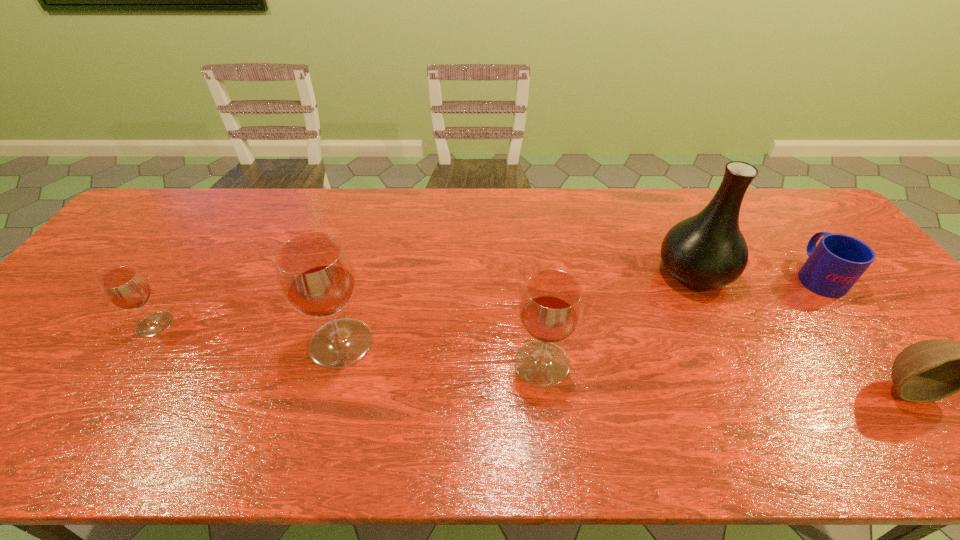
Locate an element on the screen. This screenshot has width=960, height=540. the shortest wineglass is located at coordinates (125, 287).

The image size is (960, 540). I want to click on the leftmost object, so click(x=125, y=287).

The image size is (960, 540). I want to click on the second object from left to right, so click(315, 274).

At what (x,y) coordinates should I click in order to perform the action: click on the fourth shortest object. Please return your answer as a coordinate pair (x, y). Looking at the image, I should click on (551, 305).

The image size is (960, 540). I want to click on the third object from left to right, so [x=551, y=305].

Where is `the shortest object`? the shortest object is located at coordinates (833, 266).

Locate an element on the screen. bowl is located at coordinates (931, 370).

Locate an element on the screen. vase is located at coordinates (707, 251).

Identify the location of free space located on the back of the shortest wineglass. Image resolution: width=960 pixels, height=540 pixels. (185, 279).

This screenshot has width=960, height=540. Identify the location of free location located 0.350m on the right of the second object from left to right. (516, 343).